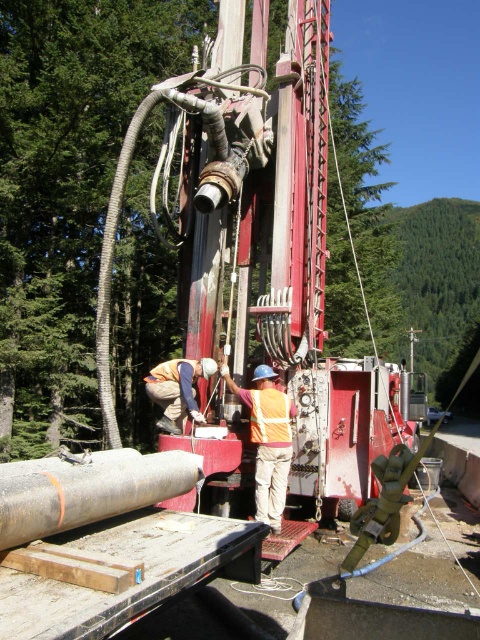
You are a safety inspector standing at the edge of the construction site. You notice a point marked at coordinates (288, 428) in the image. According to safety regulations, all workers must stay at least 5 meters away from this point. Can you confirm if the workers are compliant with this rule?

The point at coordinates (288, 428) is 6.16 meters away from the viewer. Since the workers are positioned closer to the camera than this point, they are within the 5 meter safety zone and not compliant with the regulation.

You are a construction supervisor checking the safety of the site. You notice the metallic red trailer truck at center and the orange reflective vest at center. Which object is narrower in width?

The metallic red trailer truck at center is thinner than orange reflective vest at center, so the metallic red trailer truck at center is narrower in width.